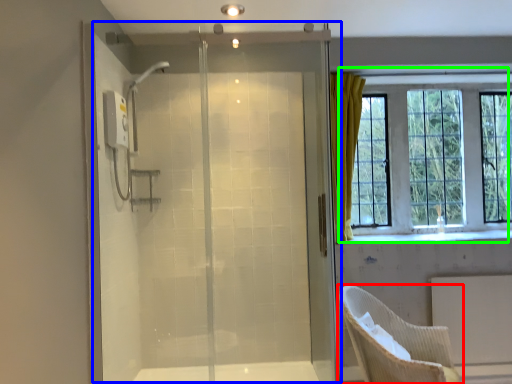
Question: Which is nearer to the chair (highlighted by a red box)? screen door (highlighted by a blue box) or window (highlighted by a green box).

Choices:
 (A) screen door
 (B) window

Answer: (A)